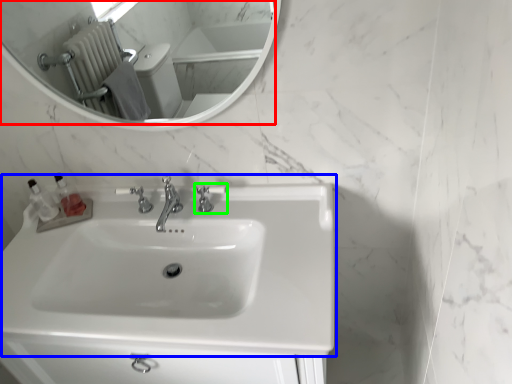
Question: Considering the real-world distances, which object is farthest from mirror (highlighted by a red box)? sink (highlighted by a blue box) or tap (highlighted by a green box)?

Choices:
 (A) sink
 (B) tap

Answer: (B)